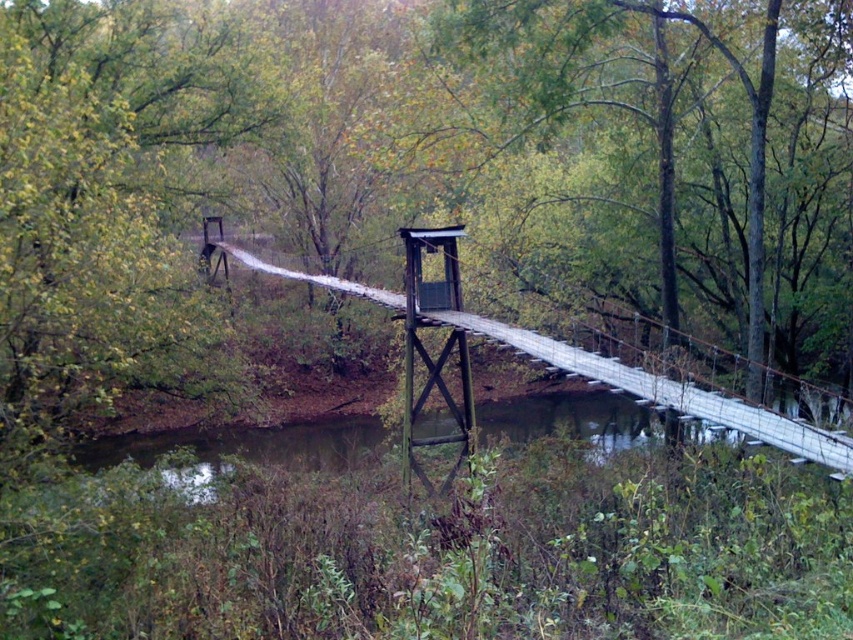
You are standing on the wooden suspension bridge at center and looking towards the green leafy tree at center. Which direction should you walk to get closer to the tree?

The green leafy tree at center is positioned over the wooden suspension bridge at center, so you should walk forward along the bridge to get closer to the tree.

You are standing on the suspension bridge and want to locate the green leafy tree at center. According to the coordinates given, where should you look relative to the bridge?

The green leafy tree at center is located at coordinates point (676, 157), which is approximately 24.8 percent from the left edge and 79.4 percent from the top edge of the image. So, you should look slightly to the left and mostly downward from the bridge to find it.

You are standing on the suspension bridge and looking towards the dense vegetation. There are two points marked on the bridge, point (590,38) and point (238,257). Which point is closer to you?

Point (590,38) is closer to the camera than point (238,257), so the point closer to you is point (590,38).